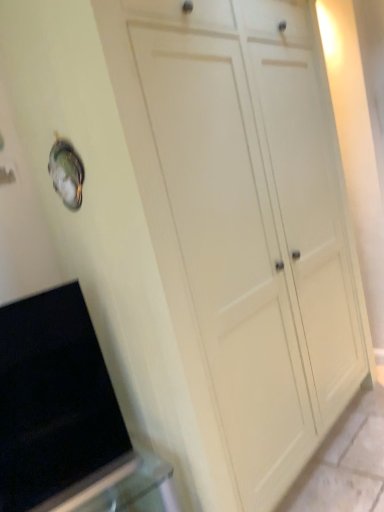
Question: From the image's perspective, is black matte oven at lower left on top of white matte cupboard at center?

Choices:
 (A) yes
 (B) no

Answer: (B)

Question: Can you confirm if black matte oven at lower left is positioned to the right of white matte cupboard at center?

Choices:
 (A) no
 (B) yes

Answer: (A)

Question: Is black matte oven at lower left thinner than white matte cupboard at center?

Choices:
 (A) no
 (B) yes

Answer: (B)

Question: Does black matte oven at lower left lie behind white matte cupboard at center?

Choices:
 (A) no
 (B) yes

Answer: (B)

Question: From the image's perspective, is black matte oven at lower left located beneath white matte cupboard at center?

Choices:
 (A) no
 (B) yes

Answer: (B)

Question: Considering the relative positions of black matte oven at lower left and white matte cupboard at center in the image provided, is black matte oven at lower left to the left of white matte cupboard at center from the viewer's perspective?

Choices:
 (A) no
 (B) yes

Answer: (B)

Question: Is white matte cupboard at center thinner than black matte oven at lower left?

Choices:
 (A) no
 (B) yes

Answer: (A)

Question: Is white matte cupboard at center positioned beyond the bounds of black matte oven at lower left?

Choices:
 (A) yes
 (B) no

Answer: (A)

Question: From a real-world perspective, is white matte cupboard at center positioned over black matte oven at lower left based on gravity?

Choices:
 (A) no
 (B) yes

Answer: (B)

Question: Considering the relative sizes of white matte cupboard at center and black matte oven at lower left in the image provided, is white matte cupboard at center bigger than black matte oven at lower left?

Choices:
 (A) yes
 (B) no

Answer: (A)

Question: Is white matte cupboard at center in front of black matte oven at lower left?

Choices:
 (A) no
 (B) yes

Answer: (B)

Question: From the image's perspective, is white matte cupboard at center over black matte oven at lower left?

Choices:
 (A) yes
 (B) no

Answer: (A)

Question: From the image's perspective, is black matte oven at lower left above or below white matte cupboard at center?

Choices:
 (A) above
 (B) below

Answer: (B)